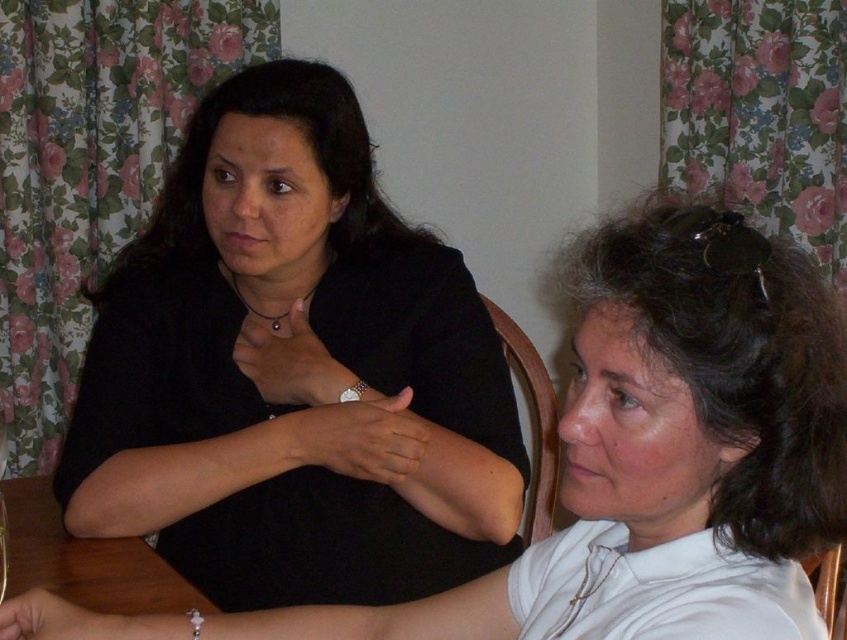
You are standing in the room and want to place a small vase between the matte black shirt at upper left and the brown wooden table at lower left. Which object should you place the vase closer to if you want it to be closer to the viewer?

The vase should be placed closer to the matte black shirt at upper left because it is closer to the viewer than the brown wooden table at lower left.

You are trying to place a decorative vase on the brown wooden table at lower left. However, there is already a matte black shirt at center on the table. Where exactly should you place the vase to avoid covering the shirt?

The matte black shirt at center is positioned on the right side of the brown wooden table at lower left, so placing the vase on the left side of the brown wooden table at lower left would avoid covering it.

You are a photographer setting up a shoot in this room. You want to place a small lamp between the matte black shirt at center and the brown wooden table at lower left. Based on their positions, where should the lamp be placed?

The brown wooden table at lower left is behind the matte black shirt at center, so the lamp should be placed in front of the brown wooden table at lower left and behind the matte black shirt at center to position it between them.